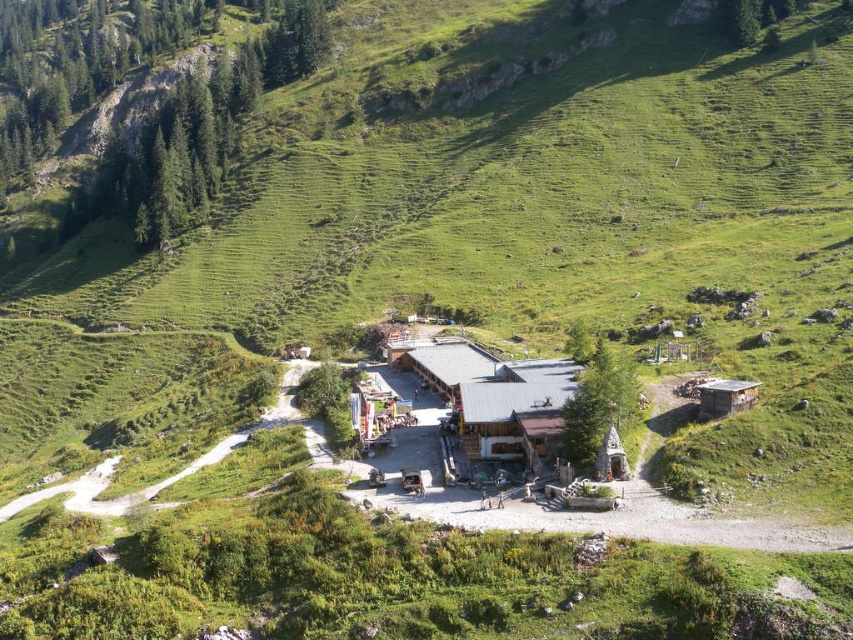
Question: Is brown wooden hut at center thinner than wooden cabin at right?

Choices:
 (A) no
 (B) yes

Answer: (A)

Question: Does brown wooden hut at center have a smaller size compared to wooden cabin at right?

Choices:
 (A) yes
 (B) no

Answer: (B)

Question: Estimate the real-world distances between objects in this image. Which object is closer to the wooden cabin at right?

Choices:
 (A) brown wooden hut at center
 (B) wooden cabin at center

Answer: (B)

Question: Among these points, which one is farthest from the camera?

Choices:
 (A) (717, 406)
 (B) (451, 362)
 (C) (460, 413)

Answer: (B)

Question: From the image, what is the correct spatial relationship of wooden cabin at center in relation to brown wooden hut at center?

Choices:
 (A) left
 (B) right

Answer: (B)

Question: Among these points, which one is nearest to the camera?

Choices:
 (A) (717, 408)
 (B) (494, 442)
 (C) (413, 353)

Answer: (A)